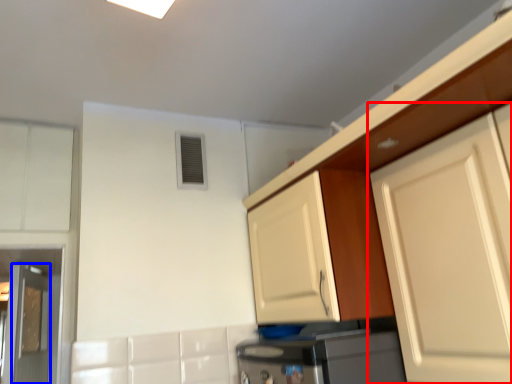
Question: Which object is closer to the camera taking this photo, cabinetry (highlighted by a red box) or door (highlighted by a blue box)?

Choices:
 (A) cabinetry
 (B) door

Answer: (A)